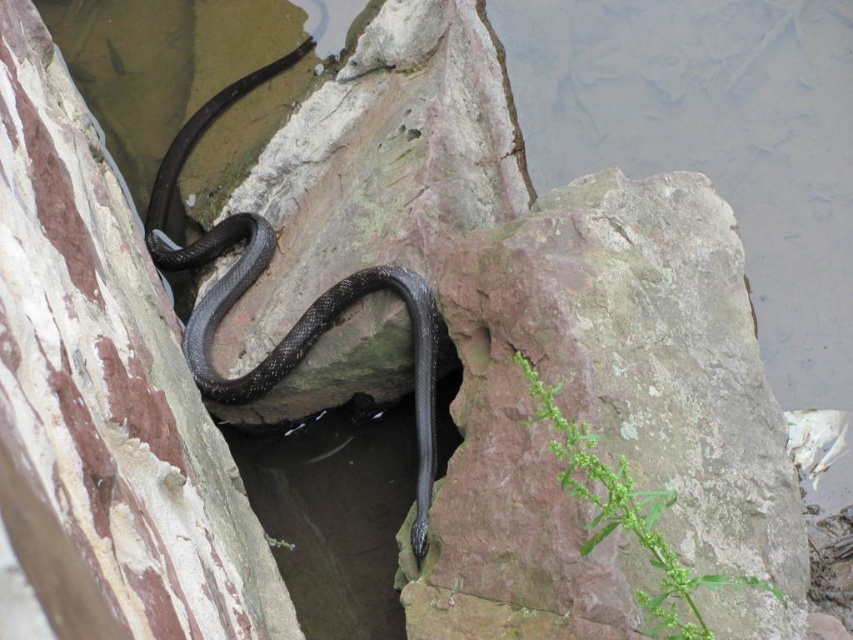
Question: Which point appears closest to the camera in this image?

Choices:
 (A) (181, 147)
 (B) (567, 502)

Answer: (B)

Question: Can you confirm if rusty stone at center is bigger than shiny black snake at center?

Choices:
 (A) no
 (B) yes

Answer: (A)

Question: Considering the relative positions of rusty stone at center and shiny black snake at center in the image provided, where is rusty stone at center located with respect to shiny black snake at center?

Choices:
 (A) left
 (B) right

Answer: (B)

Question: Observing the image, what is the correct spatial positioning of rusty stone at center in reference to shiny black snake at center?

Choices:
 (A) below
 (B) above

Answer: (A)